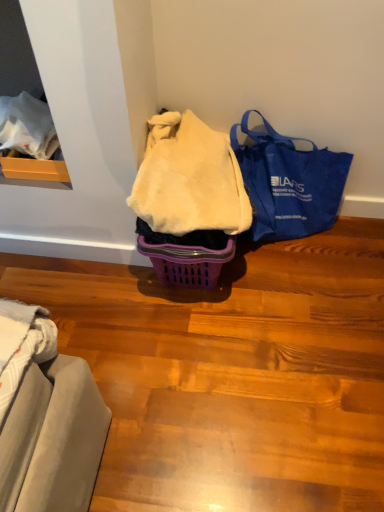
The width and height of the screenshot is (384, 512). What are the coordinates of `free point to the right of blue canvas tote bag at right` in the screenshot? It's located at (359, 248).